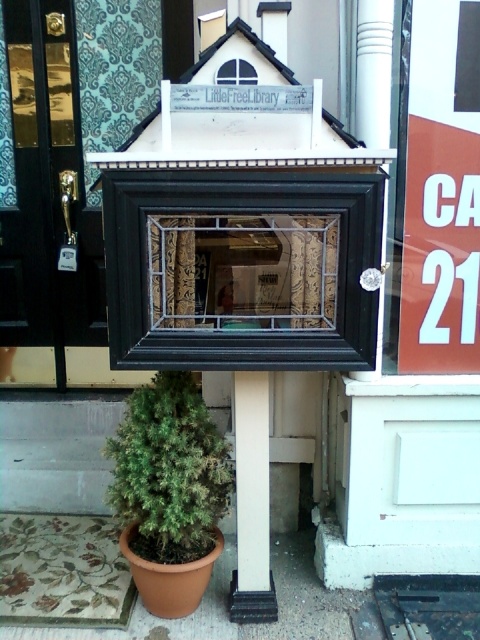
Who is positioned more to the right, black wood frame at center or orange paper sign at right?

From the viewer's perspective, orange paper sign at right appears more on the right side.

Is point (141, 330) in front of point (422, 196)?

Yes, it is in front of point (422, 196).

Which is behind, point (220, 264) or point (445, 304)?

Point (445, 304)

You are a GUI agent. You are given a task and a screenshot of the screen. Output one action in this format:
    pyautogui.click(x=<x>, y=<y>)
    Task: Click on the black wood frame at center
    
    Given the screenshot: What is the action you would take?
    pyautogui.click(x=240, y=268)

Does white smooth pillar at lower center come in front of clear glass window at center?

No, it is behind clear glass window at center.

Can you confirm if white smooth pillar at lower center is positioned to the right of clear glass window at center?

Correct, you'll find white smooth pillar at lower center to the right of clear glass window at center.

Describe the element at coordinates (252, 502) in the screenshot. The width and height of the screenshot is (480, 640). I see `white smooth pillar at lower center` at that location.

Where is `white smooth pillar at lower center`? The image size is (480, 640). white smooth pillar at lower center is located at coordinates (252, 502).

Is point (140, 320) positioned in front of point (240, 515)?

Yes, it is.

Does black wood frame at center have a lesser width compared to white smooth pillar at lower center?

In fact, black wood frame at center might be wider than white smooth pillar at lower center.

Who is more forward, [359,298] or [239,420]?

Point [359,298] is in front.

Locate an element on the screen. black wood frame at center is located at coordinates (240, 268).